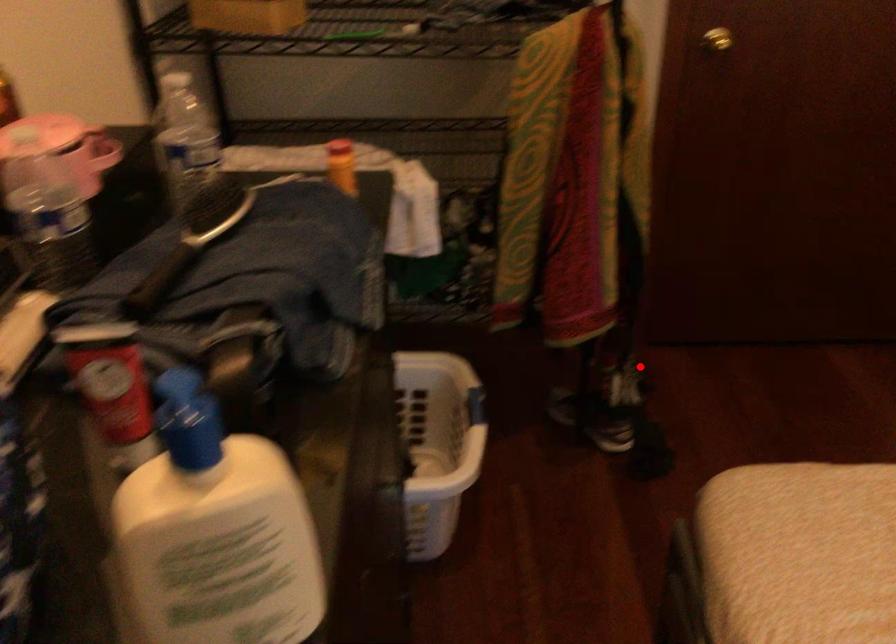
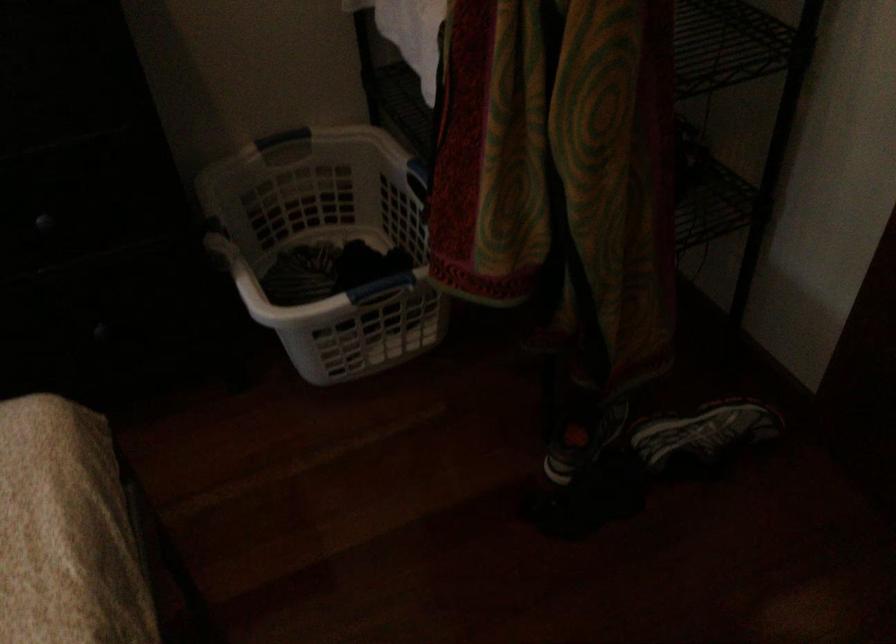
Locate, in the second image, the point that corresponds to the highlighted location in the first image.

(702, 436)